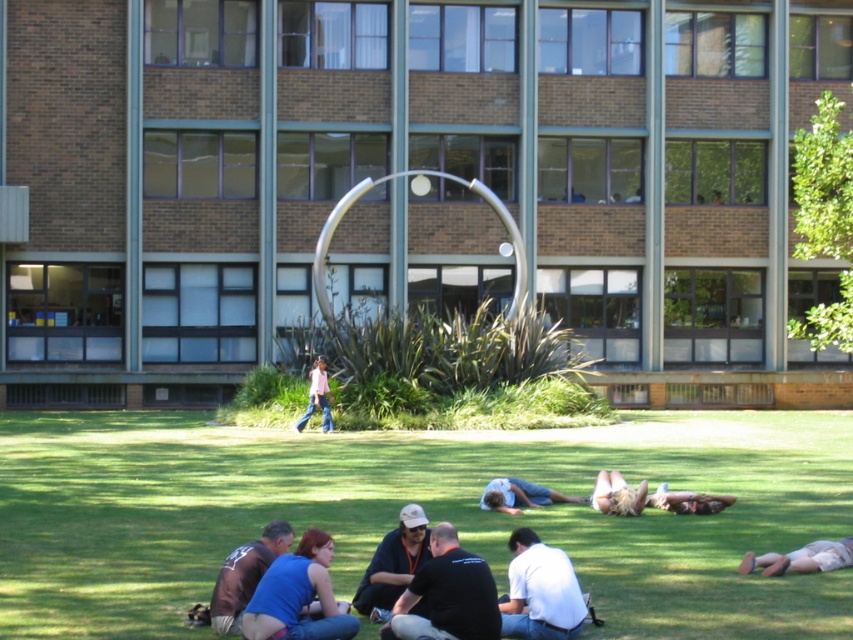
Which is more to the left, dark gray shirt at center or light brown fabric pants at lower right?

From the viewer's perspective, dark gray shirt at center appears more on the left side.

What do you see at coordinates (447, 595) in the screenshot?
I see `dark gray shirt at center` at bounding box center [447, 595].

Does point (412, 628) come in front of point (842, 545)?

Yes, it is in front of point (842, 545).

Image resolution: width=853 pixels, height=640 pixels. What are the coordinates of `dark gray shirt at center` in the screenshot? It's located at (447, 595).

Who is positioned more to the left, dark blue shirt at lower center or smooth tan skin at lower right?

Positioned to the left is dark blue shirt at lower center.

Identify the location of dark blue shirt at lower center. (393, 561).

Can you confirm if dark gray shirt at center is positioned to the left of pink fabric shirt at center?

In fact, dark gray shirt at center is to the right of pink fabric shirt at center.

Does point (479, 588) lie in front of point (302, 428)?

Yes.

Identify the location of dark gray shirt at center. This screenshot has height=640, width=853. (447, 595).